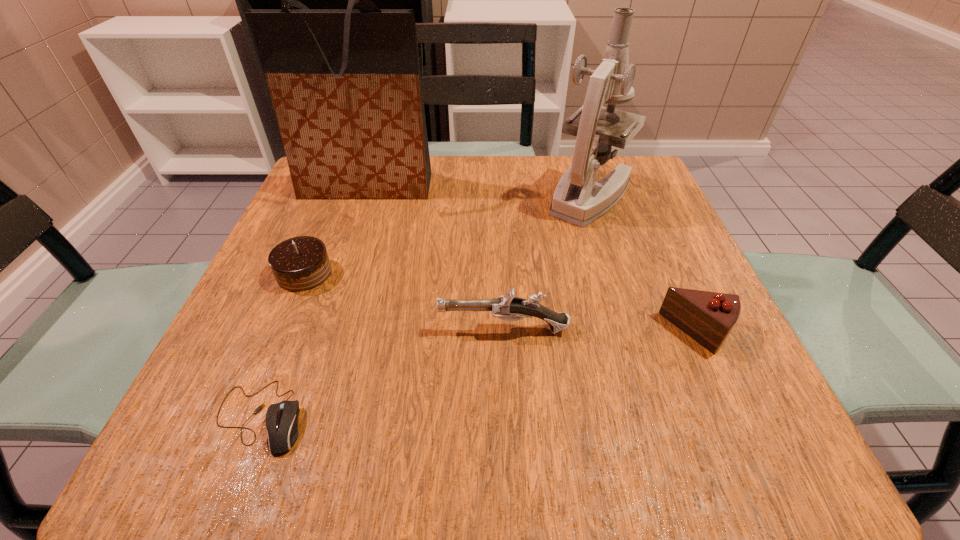
The image size is (960, 540). Find the location of `free region at the far right corner of the desktop`. free region at the far right corner of the desktop is located at coordinates (646, 190).

Locate an element on the screen. Image resolution: width=960 pixels, height=540 pixels. free space between the third object from right to left and the computer mouse is located at coordinates (382, 373).

Locate an element on the screen. vacant point located between the shortest object and the microscope is located at coordinates (425, 306).

The height and width of the screenshot is (540, 960). What are the coordinates of `vacant space that's between the nearer chocolate cake and the shortest object` in the screenshot? It's located at (479, 374).

In order to click on vacant space that's between the microscope and the left chocolate cake in this screenshot , I will do `click(447, 234)`.

Identify the location of vacant area between the nearest object and the right chocolate cake. (479, 374).

Identify the location of free space between the third object from right to left and the left chocolate cake. (404, 301).

Where is `vacant point located between the shopping bag and the left chocolate cake`? vacant point located between the shopping bag and the left chocolate cake is located at coordinates (335, 230).

This screenshot has width=960, height=540. Identify the location of blank region between the fourth object from left to right and the shopping bag. (435, 258).

Find the location of `free spot between the gun and the microscope`. free spot between the gun and the microscope is located at coordinates (547, 262).